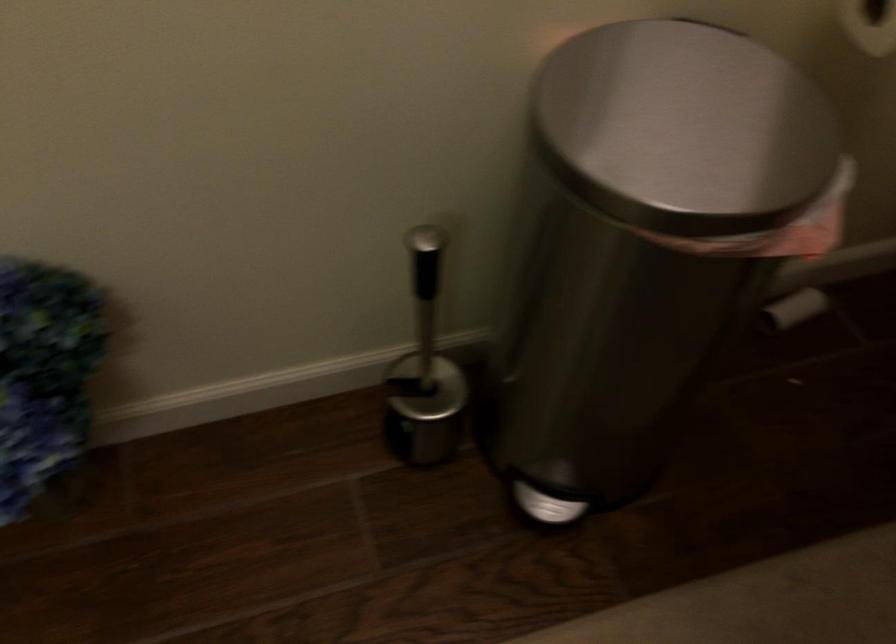
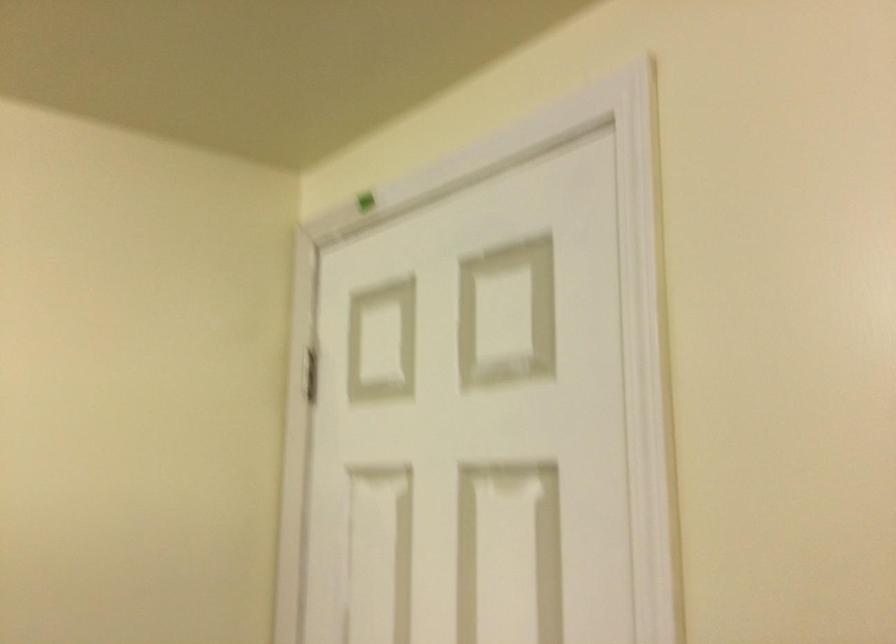
First-person continuous shooting, in which direction is the camera rotating?

The rotation direction of the camera is left-up.